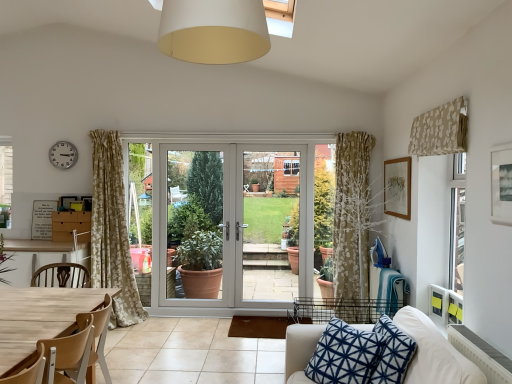
Question: Is wooden picture frame at upper right, the 1th picture frame positioned from the right, looking in the opposite direction of white glossy door at center, marked as the 3th screen door in a left-to-right arrangement?

Choices:
 (A) no
 (B) yes

Answer: (A)

Question: Is the position of wooden picture frame at upper right, acting as the 2th picture frame starting from the left, more distant than that of white glossy door at center, which appears as the 1th screen door when viewed from the right?

Choices:
 (A) yes
 (B) no

Answer: (B)

Question: Is wooden picture frame at upper right, arranged as the second picture frame when viewed from the front, thinner than white glossy door at center, which appears as the 1th screen door when viewed from the right?

Choices:
 (A) yes
 (B) no

Answer: (A)

Question: Is white glossy door at center, marked as the 3th screen door in a left-to-right arrangement, surrounded by wooden picture frame at upper right, the 1th picture frame positioned from the right?

Choices:
 (A) no
 (B) yes

Answer: (A)

Question: Is wooden picture frame at upper right, arranged as the second picture frame when viewed from the front, closer to camera compared to white glossy door at center, which appears as the 1th screen door when viewed from the right?

Choices:
 (A) no
 (B) yes

Answer: (B)

Question: From a real-world perspective, relative to blue printed cushion at lower right, is white glossy door at center, which appears as the 1th screen door when viewed from the right, vertically above or below?

Choices:
 (A) above
 (B) below

Answer: (A)

Question: Is white glossy door at center, which appears as the 1th screen door when viewed from the right, spatially inside blue printed cushion at lower right, or outside of it?

Choices:
 (A) inside
 (B) outside

Answer: (B)

Question: Visually, is white glossy door at center, which appears as the 1th screen door when viewed from the right, positioned to the left or to the right of blue printed cushion at lower right?

Choices:
 (A) right
 (B) left

Answer: (B)

Question: In the image, is white glossy door at center, marked as the 3th screen door in a left-to-right arrangement, positioned in front of or behind blue printed cushion at lower right?

Choices:
 (A) behind
 (B) front

Answer: (A)

Question: Does point (186, 273) appear closer or farther from the camera than point (77, 379)?

Choices:
 (A) closer
 (B) farther

Answer: (B)

Question: Relative to light brown wood chair at lower left, is matte white screen door at center, arranged as the 3th screen door when viewed from the right, in front or behind?

Choices:
 (A) behind
 (B) front

Answer: (A)

Question: From the image's perspective, relative to light brown wood chair at lower left, is matte white screen door at center, which is the 1th screen door in left-to-right order, above or below?

Choices:
 (A) below
 (B) above

Answer: (B)

Question: Is matte white screen door at center, which is the 1th screen door in left-to-right order, inside or outside of light brown wood chair at lower left?

Choices:
 (A) inside
 (B) outside

Answer: (B)

Question: Is point (192, 274) closer or farther from the camera than point (291, 158)?

Choices:
 (A) closer
 (B) farther

Answer: (B)

Question: Is matte white screen door at center, which is the 1th screen door in left-to-right order, in front of or behind white glossy door at center, which appears as the 1th screen door when viewed from the right, in the image?

Choices:
 (A) behind
 (B) front

Answer: (A)